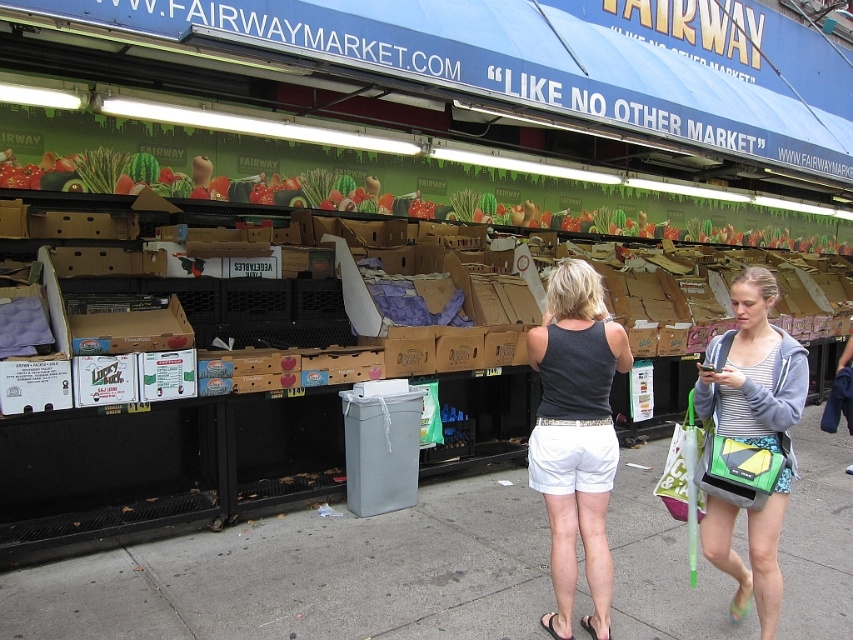
You are a customer standing in front of the Fairway Market display. You see the green leafy vegetables at upper center and the dark gray tank top at center. Which item is taller?

The dark gray tank top at center is taller than the green leafy vegetables at upper center because the green leafy vegetables at upper center is not as tall as dark gray tank top at center.

You are standing at the entrance of the Fairway Market and see two points marked on the ground. The first point is at coordinate point (468, 182) and the second is at point (556, 310). From your perspective at the entrance, which point is closer to you?

Point (556, 310) is closer to you because the description states that point (468, 182) is behind point (556, 310), meaning the latter is in front and thus nearer to your position at the entrance.